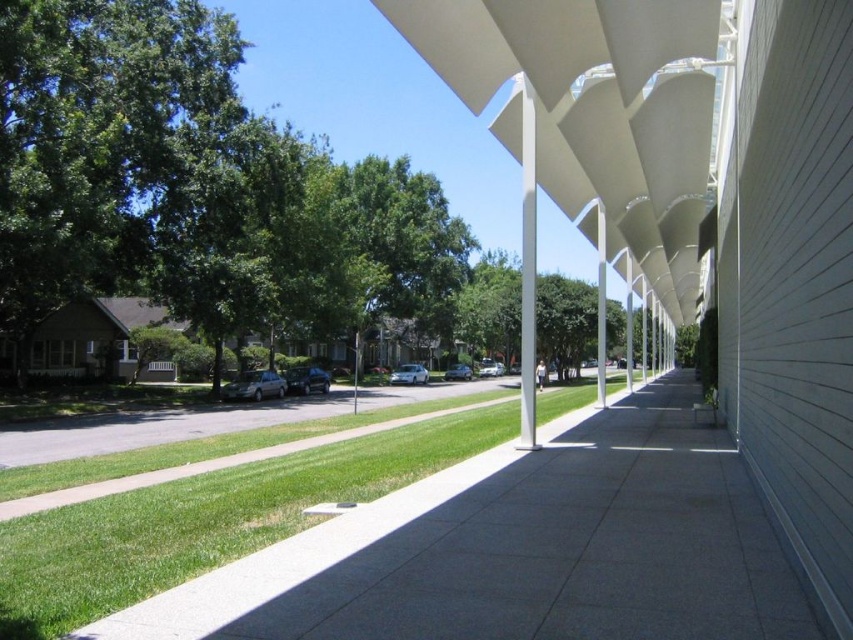
You are standing on the sidewalk in the suburban street scene. You see a point marked at coordinates [593,108]. Based on the scene description, can you determine what object this point is located on?

The point at coordinates [593,108] is located on the white matte awning at center.

You are a gardener planning to plant a new tree in the suburban street scene. The tree requires a minimum of 3 meters of space between its base and any structure. Considering the white matte awning at center and the green grass at center, which location would allow enough space for the tree to grow without encroaching on the awning?

The green grass at center is farther away from the white matte awning at center, so planting the tree there would provide sufficient space for growth without encroaching on the awning.

You are a delivery person with a cart that is 2 meters wide. You need to move from the street to the sidewalk. There is a white matte awning at center and a green grass at center in your path. Can your cart fit through the space between them?

The white matte awning at center might be wider than green grass at center, so the space between them may not be wide enough for a 2 meter wide cart. Check the actual width before proceeding.